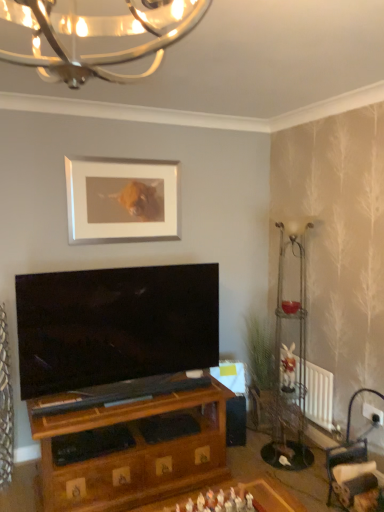
Where is `metallic textured curtain at left`? This screenshot has width=384, height=512. metallic textured curtain at left is located at coordinates (5, 406).

Measure the distance between point [297,407] and camera.

Point [297,407] and camera are 2.99 meters apart from each other.

Where is `white radiator at lower right`? This screenshot has width=384, height=512. white radiator at lower right is located at coordinates (319, 396).

Describe the element at coordinates (319, 396) in the screenshot. I see `white radiator at lower right` at that location.

Locate an element on the screen. metallic textured curtain at left is located at coordinates (5, 406).

Is metallic textured curtain at left situated inside metallic wire floor lamp at right or outside?

metallic textured curtain at left is outside metallic wire floor lamp at right.

Locate an element on the screen. lamp on the right of metallic textured curtain at left is located at coordinates (289, 351).

From the image's perspective, which object appears higher, metallic textured curtain at left or metallic wire floor lamp at right?

metallic wire floor lamp at right, from the image's perspective.

Considering the relative positions of white radiator at lower right and white matte picture frame at upper center in the image provided, is white radiator at lower right to the left or to the right of white matte picture frame at upper center?

Clearly, white radiator at lower right is on the right of white matte picture frame at upper center in the image.

Based on the photo, from a real-world perspective, is white radiator at lower right beneath white matte picture frame at upper center?

Yes.

Is white radiator at lower right located outside white matte picture frame at upper center?

Yes, white radiator at lower right is outside of white matte picture frame at upper center.

Is white radiator at lower right with white matte picture frame at upper center?

white radiator at lower right and white matte picture frame at upper center are clearly separated.

Between metallic textured curtain at left and white matte picture frame at upper center, which one has more height?

With more height is metallic textured curtain at left.

Would you say metallic textured curtain at left contains white matte picture frame at upper center?

No.

Is metallic textured curtain at left far from white matte picture frame at upper center?

metallic textured curtain at left is positioned a significant distance from white matte picture frame at upper center.

Between metallic textured curtain at left and white matte picture frame at upper center, which one is positioned in front?

metallic textured curtain at left is more forward.

Considering the relative sizes of metallic wire floor lamp at right and white matte picture frame at upper center in the image provided, is metallic wire floor lamp at right thinner than white matte picture frame at upper center?

In fact, metallic wire floor lamp at right might be wider than white matte picture frame at upper center.

Looking at this image, which is in front, metallic wire floor lamp at right or white matte picture frame at upper center?

metallic wire floor lamp at right is in front.

Considering the positions of objects metallic wire floor lamp at right and white matte picture frame at upper center in the image provided, who is more to the left, metallic wire floor lamp at right or white matte picture frame at upper center?

Positioned to the left is white matte picture frame at upper center.

The height and width of the screenshot is (512, 384). I want to click on picture frame on the left side of metallic wire floor lamp at right, so click(x=122, y=200).

Considering the sizes of objects white radiator at lower right and metallic textured curtain at left in the image provided, who is thinner, white radiator at lower right or metallic textured curtain at left?

white radiator at lower right.

Does white radiator at lower right have a greater height compared to metallic textured curtain at left?

No, white radiator at lower right is not taller than metallic textured curtain at left.

From a real-world perspective, between white radiator at lower right and metallic textured curtain at left, who is vertically higher?

From a 3D spatial view, metallic textured curtain at left is above.

Are white radiator at lower right and metallic textured curtain at left making contact?

No.

Identify the location of picture frame that appears behind the metallic wire floor lamp at right. The image size is (384, 512). (122, 200).

Is white matte picture frame at upper center thinner than metallic wire floor lamp at right?

Yes.

Is white matte picture frame at upper center far from metallic wire floor lamp at right?

Yes, white matte picture frame at upper center and metallic wire floor lamp at right are quite far apart.

From a real-world perspective, is metallic wire floor lamp at right located higher than metallic textured curtain at left?

Yes, from a real-world perspective, metallic wire floor lamp at right is over metallic textured curtain at left

Can you confirm if metallic wire floor lamp at right is positioned to the right of metallic textured curtain at left?

Yes, metallic wire floor lamp at right is to the right of metallic textured curtain at left.

Is metallic wire floor lamp at right in front of or behind metallic textured curtain at left in the image?

Clearly, metallic wire floor lamp at right is behind metallic textured curtain at left.

How many degrees apart are the facing directions of metallic wire floor lamp at right and metallic textured curtain at left?

metallic wire floor lamp at right and metallic textured curtain at left are facing 45.7 degrees away from each other.

At what (x,y) coordinates should I click in order to perform the action: click on lamp positioned vertically above the metallic textured curtain at left (from a real-world perspective). Please return your answer as a coordinate pair (x, y). Looking at the image, I should click on (289, 351).

Locate an element on the screen. radiator below the white matte picture frame at upper center (from a real-world perspective) is located at coordinates (319, 396).

Based on their spatial positions, is white radiator at lower right or white matte picture frame at upper center closer to metallic textured curtain at left?

Based on the image, white matte picture frame at upper center appears to be nearer to metallic textured curtain at left.

Estimate the real-world distances between objects in this image. Which object is closer to white radiator at lower right, metallic textured curtain at left or metallic wire floor lamp at right?

metallic wire floor lamp at right is closer to white radiator at lower right.

Estimate the real-world distances between objects in this image. Which object is closer to metallic textured curtain at left, white radiator at lower right or metallic wire floor lamp at right?

metallic wire floor lamp at right.

From the image, which object appears to be nearer to metallic wire floor lamp at right, metallic textured curtain at left or white radiator at lower right?

Based on the image, white radiator at lower right appears to be nearer to metallic wire floor lamp at right.

Based on their spatial positions, is white radiator at lower right or metallic wire floor lamp at right further from white matte picture frame at upper center?

The object further to white matte picture frame at upper center is white radiator at lower right.

When comparing their distances from metallic textured curtain at left, does metallic wire floor lamp at right or white radiator at lower right seem closer?

metallic wire floor lamp at right is closer to metallic textured curtain at left.

Based on the photo, from the image, which object appears to be nearer to white matte picture frame at upper center, metallic textured curtain at left or white radiator at lower right?

metallic textured curtain at left lies closer to white matte picture frame at upper center than the other object.

From the image, which object appears to be farther from white radiator at lower right, metallic textured curtain at left or white matte picture frame at upper center?

The object further to white radiator at lower right is metallic textured curtain at left.

Where is `lamp located between metallic textured curtain at left and white radiator at lower right in the left-right direction`? Image resolution: width=384 pixels, height=512 pixels. lamp located between metallic textured curtain at left and white radiator at lower right in the left-right direction is located at coordinates pos(289,351).

At what (x,y) coordinates should I click in order to perform the action: click on lamp between white matte picture frame at upper center and white radiator at lower right vertically. Please return your answer as a coordinate pair (x, y). This screenshot has height=512, width=384. Looking at the image, I should click on (289, 351).

The image size is (384, 512). What are the coordinates of `picture frame between metallic textured curtain at left and metallic wire floor lamp at right from left to right` in the screenshot? It's located at (122, 200).

At what (x,y) coordinates should I click in order to perform the action: click on picture frame between metallic textured curtain at left and white radiator at lower right. Please return your answer as a coordinate pair (x, y). The height and width of the screenshot is (512, 384). Looking at the image, I should click on (x=122, y=200).